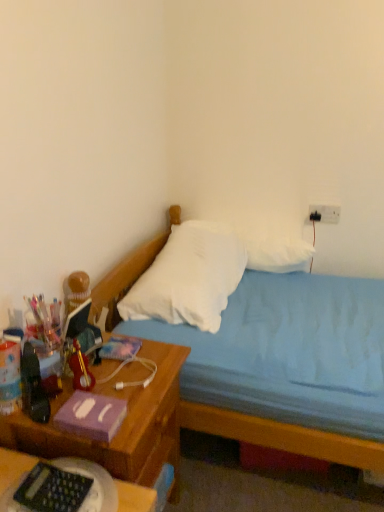
The height and width of the screenshot is (512, 384). What do you see at coordinates (276, 253) in the screenshot? I see `white soft pillow at upper center, which appears as the 2th pillow when viewed from the front` at bounding box center [276, 253].

This screenshot has height=512, width=384. What do you see at coordinates (281, 437) in the screenshot?
I see `blue fabric bed at center` at bounding box center [281, 437].

Find the location of `white soft pillow at center, the 2th pillow viewed from the back`. white soft pillow at center, the 2th pillow viewed from the back is located at coordinates (189, 277).

Describe the element at coordinates (135, 498) in the screenshot. I see `black plastic keyboard at lower left` at that location.

Locate an element on the screen. The image size is (384, 512). black plastic keyboard at lower left is located at coordinates (135, 498).

At what (x,y) coordinates should I click in order to perform the action: click on white soft pillow at upper center, which appears as the 2th pillow when viewed from the front. Please return your answer as a coordinate pair (x, y). The image size is (384, 512). Looking at the image, I should click on (276, 253).

Is white soft pillow at upper center, arranged as the 1th pillow when viewed from the back, positioned before white soft pillow at center, the 1th pillow in the front-to-back sequence?

No, white soft pillow at upper center, arranged as the 1th pillow when viewed from the back, is behind white soft pillow at center, the 1th pillow in the front-to-back sequence.

In the scene shown: From the image's perspective, is white soft pillow at upper center, which appears as the 2th pillow when viewed from the front, above white soft pillow at center, the 1th pillow in the front-to-back sequence?

Yes.

From a real-world perspective, is white soft pillow at upper center, which appears as the 2th pillow when viewed from the front, positioned under white soft pillow at center, the 1th pillow in the front-to-back sequence, based on gravity?

No, from a real-world perspective, white soft pillow at upper center, which appears as the 2th pillow when viewed from the front, is not under white soft pillow at center, the 1th pillow in the front-to-back sequence.

From the picture: Are white soft pillow at upper center, arranged as the 1th pillow when viewed from the back, and white soft pillow at center, the 1th pillow in the front-to-back sequence, making contact?

No, white soft pillow at upper center, arranged as the 1th pillow when viewed from the back, is not in contact with white soft pillow at center, the 1th pillow in the front-to-back sequence.

Can you confirm if white soft pillow at upper center, which appears as the 2th pillow when viewed from the front, is wider than woodennightstand at left?

In fact, white soft pillow at upper center, which appears as the 2th pillow when viewed from the front, might be narrower than woodennightstand at left.

Considering their positions, is white soft pillow at upper center, which appears as the 2th pillow when viewed from the front, located in front of or behind woodennightstand at left?

white soft pillow at upper center, which appears as the 2th pillow when viewed from the front, is behind woodennightstand at left.

Considering the positions of points (251, 252) and (175, 429), is point (251, 252) farther from camera compared to point (175, 429)?

Yes.

Is white plastic electric outlet at upper right not within blue fabric bed at center?

Absolutely, white plastic electric outlet at upper right is external to blue fabric bed at center.

Would you say white plastic electric outlet at upper right is to the left or to the right of blue fabric bed at center in the picture?

white plastic electric outlet at upper right is positioned on blue fabric bed at center's right side.

Is point (324, 208) closer or farther from the camera than point (210, 408)?

Point (324, 208).

Is blue fabric bed at center at the back of white plastic electric outlet at upper right?

white plastic electric outlet at upper right does not have its back to blue fabric bed at center.

Is woodennightstand at left a part of blue fabric bed at center?

No, woodennightstand at left is not a part of blue fabric bed at center.

How different are the orientations of blue fabric bed at center and woodennightstand at left in degrees?

The angle between the facing direction of blue fabric bed at center and the facing direction of woodennightstand at left is 0.000244 degrees.

Which of these two, blue fabric bed at center or woodennightstand at left, is bigger?

With larger size is blue fabric bed at center.

Considering the relative sizes of blue fabric bed at center and woodennightstand at left in the image provided, is blue fabric bed at center shorter than woodennightstand at left?

In fact, blue fabric bed at center may be taller than woodennightstand at left.

You are a GUI agent. You are given a task and a screenshot of the screen. Output one action in this format:
    pyautogui.click(x=<x>, y=<y>)
    Task: Click on the nightstand in front of the blue fabric bed at center
    This screenshot has height=512, width=384.
    Given the screenshot: What is the action you would take?
    pyautogui.click(x=122, y=424)

Which is behind, point (134, 391) or point (114, 294)?

The point (114, 294) is farther from the camera.

From the image's perspective, is woodennightstand at left beneath blue fabric bed at center?

Indeed, from the image's perspective, woodennightstand at left is shown beneath blue fabric bed at center.

Is woodennightstand at left not inside blue fabric bed at center?

Indeed, woodennightstand at left is completely outside blue fabric bed at center.

Where is `desk that is below the white plastic electric outlet at upper right (from the image's perspective)`? desk that is below the white plastic electric outlet at upper right (from the image's perspective) is located at coordinates pyautogui.click(x=135, y=498).

Is black plastic keyboard at lower left spatially inside white plastic electric outlet at upper right, or outside of it?

black plastic keyboard at lower left exists outside the volume of white plastic electric outlet at upper right.

Is black plastic keyboard at lower left with white plastic electric outlet at upper right?

No, black plastic keyboard at lower left is not touching white plastic electric outlet at upper right.

Does woodennightstand at left turn towards white plastic electric outlet at upper right?

No.

Considering the relative sizes of woodennightstand at left and white plastic electric outlet at upper right in the image provided, is woodennightstand at left shorter than white plastic electric outlet at upper right?

No.

From the image's perspective, which one is positioned higher, woodennightstand at left or white plastic electric outlet at upper right?

white plastic electric outlet at upper right is shown above in the image.

Identify the location of pillow behind the white soft pillow at center, the 1th pillow in the front-to-back sequence. The image size is (384, 512). (276, 253).

From a real-world perspective, count 2nd pillows upward from the woodennightstand at left and point to it. Please provide its 2D coordinates.

[(276, 253)]

Looking at the image, which one is located further to black plastic keyboard at lower left, white soft pillow at upper center, arranged as the 1th pillow when viewed from the back, or white plastic electric outlet at upper right?

white plastic electric outlet at upper right is further to black plastic keyboard at lower left.

From the image, which object appears to be farther from woodennightstand at left, blue fabric bed at center or white soft pillow at center, the 2th pillow viewed from the back?

white soft pillow at center, the 2th pillow viewed from the back, lies further to woodennightstand at left than the other object.

Which object lies nearer to the anchor point white plastic electric outlet at upper right, white soft pillow at center, the 1th pillow in the front-to-back sequence, or woodennightstand at left?

white soft pillow at center, the 1th pillow in the front-to-back sequence, is closer to white plastic electric outlet at upper right.

Looking at the image, which one is located further to black plastic keyboard at lower left, white soft pillow at center, the 1th pillow in the front-to-back sequence, or white soft pillow at upper center, arranged as the 1th pillow when viewed from the back?

white soft pillow at upper center, arranged as the 1th pillow when viewed from the back, is further to black plastic keyboard at lower left.

Based on their spatial positions, is white soft pillow at center, the 2th pillow viewed from the back, or black plastic keyboard at lower left further from white soft pillow at upper center, which appears as the 2th pillow when viewed from the front?

Based on the image, black plastic keyboard at lower left appears to be further to white soft pillow at upper center, which appears as the 2th pillow when viewed from the front.

Based on their spatial positions, is black plastic keyboard at lower left or white plastic electric outlet at upper right further from blue fabric bed at center?

white plastic electric outlet at upper right is positioned further to the anchor blue fabric bed at center.

From the image, which object appears to be nearer to white soft pillow at center, the 1th pillow in the front-to-back sequence, woodennightstand at left or blue fabric bed at center?

woodennightstand at left.

Which object lies further to the anchor point black plastic keyboard at lower left, white soft pillow at center, the 1th pillow in the front-to-back sequence, or woodennightstand at left?

Based on the image, white soft pillow at center, the 1th pillow in the front-to-back sequence, appears to be further to black plastic keyboard at lower left.

Locate an element on the screen. desk between woodennightstand at left and blue fabric bed at center is located at coordinates (135, 498).

At what (x,y) coordinates should I click in order to perform the action: click on pillow between black plastic keyboard at lower left and white soft pillow at upper center, which appears as the 2th pillow when viewed from the front, in the front-back direction. Please return your answer as a coordinate pair (x, y). This screenshot has width=384, height=512. Looking at the image, I should click on (189, 277).

Find the location of a particular element. This screenshot has width=384, height=512. bed between woodennightstand at left and white plastic electric outlet at upper right in the front-back direction is located at coordinates (281, 437).

Locate an element on the screen. The image size is (384, 512). bed between black plastic keyboard at lower left and white soft pillow at upper center, arranged as the 1th pillow when viewed from the back, in the front-back direction is located at coordinates (281, 437).